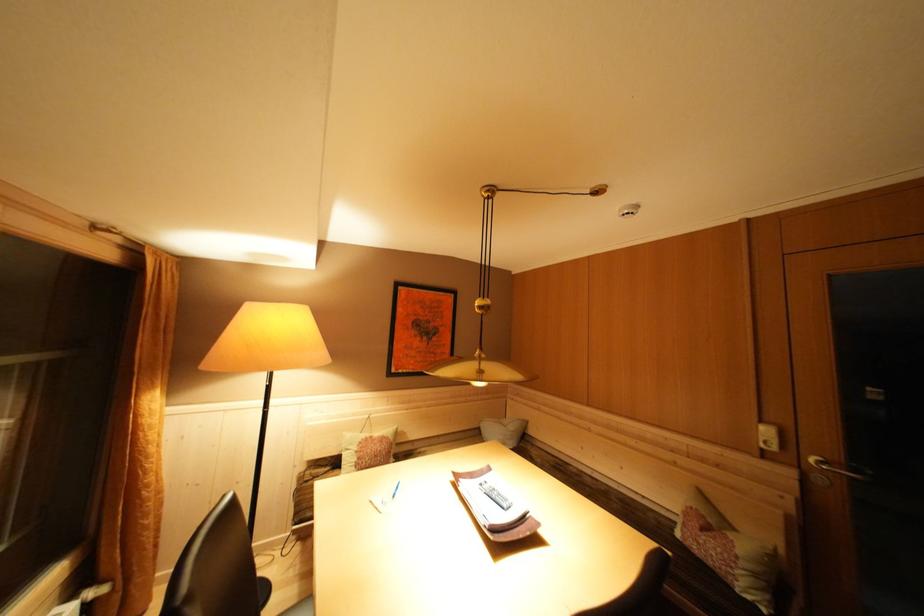
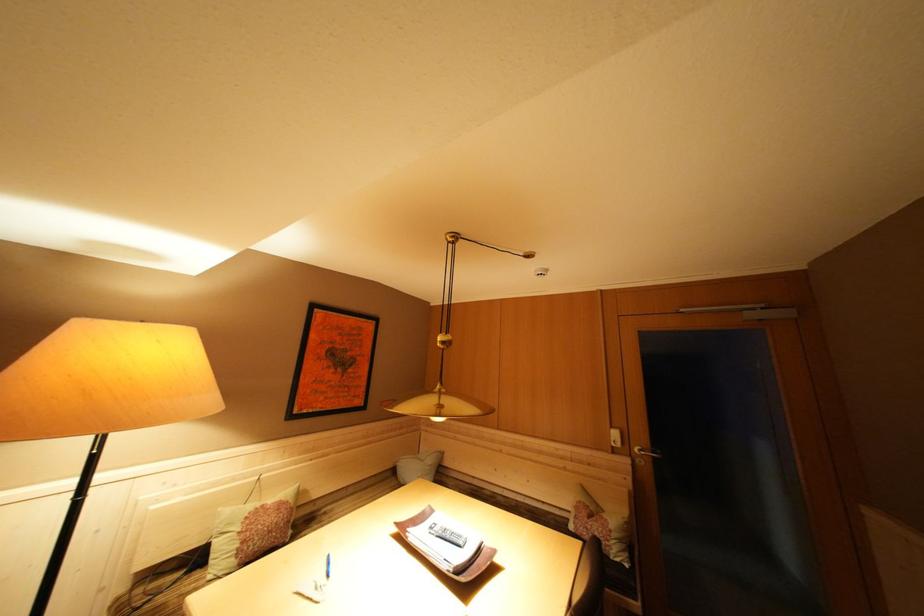
Question: In a continuous first-person perspective shot, in which direction is the camera moving?

Choices:
 (A) Left
 (B) Right
 (C) Forward
 (D) Backward

Answer: (A)